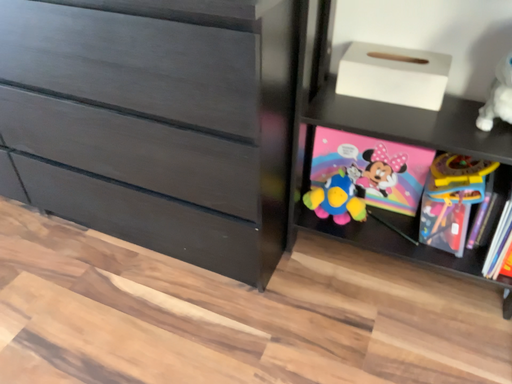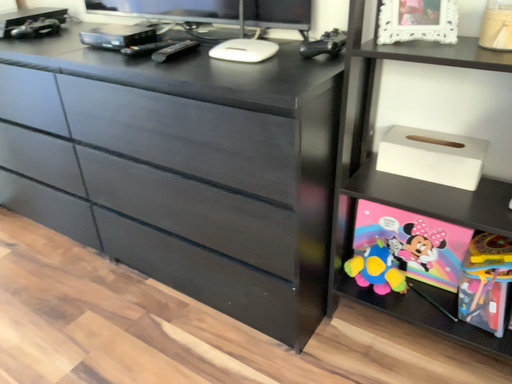
Question: Which way did the camera rotate in the video?

Choices:
 (A) rotated upward
 (B) rotated downward

Answer: (A)